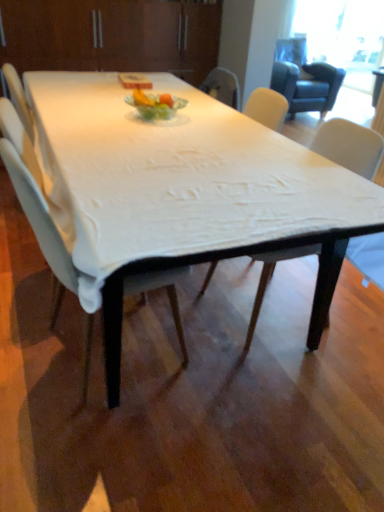
Identify the location of free space in front of white fabric chair at center, marked as the second chair in a left-to-right arrangement. (276, 385).